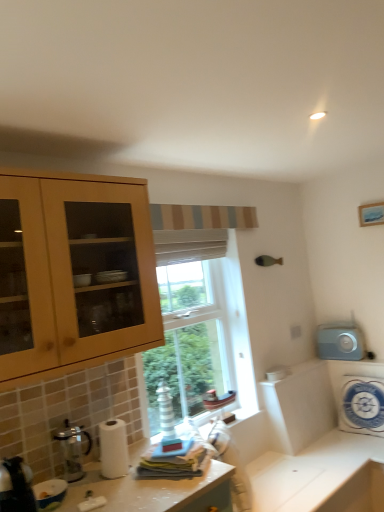
The width and height of the screenshot is (384, 512). What do you see at coordinates (50, 492) in the screenshot?
I see `white glossy bowl at lower left, which is counted as the third appliance, starting from the right` at bounding box center [50, 492].

What is the approximate height of white fabric cushion at right, acting as the fourth appliance starting from the left?

white fabric cushion at right, acting as the fourth appliance starting from the left, is 19.67 inches in height.

Where is `white fabric cushion at right, the 1th appliance viewed from the right`? This screenshot has height=512, width=384. white fabric cushion at right, the 1th appliance viewed from the right is located at coordinates (362, 405).

The image size is (384, 512). I want to click on metallic silver coffee maker at lower left, so click(72, 450).

Is white glossy countertop at lower center oriented towards gray matte clock at right, arranged as the third appliance when viewed from the left?

No, white glossy countertop at lower center is not aimed at gray matte clock at right, arranged as the third appliance when viewed from the left.

From a real-world perspective, is white glossy countertop at lower center under gray matte clock at right, arranged as the third appliance when viewed from the left?

Yes, from a real-world perspective, white glossy countertop at lower center is below gray matte clock at right, arranged as the third appliance when viewed from the left.

In the scene shown: From the image's perspective, between white glossy countertop at lower center and gray matte clock at right, which ranks as the 1th appliance in back-to-front order, who is located below?

From the image's view, white glossy countertop at lower center is below.

Looking at this image, is the depth of white glossy countertop at lower center greater than that of gray matte clock at right, arranged as the third appliance when viewed from the left?

No, white glossy countertop at lower center is in front of gray matte clock at right, arranged as the third appliance when viewed from the left.

Considering the positions of objects white glossy bowl at lower left, which is counted as the third appliance, starting from the right, and metallic silver coffee maker at lower left in the image provided, who is more to the right, white glossy bowl at lower left, which is counted as the third appliance, starting from the right, or metallic silver coffee maker at lower left?

metallic silver coffee maker at lower left.

The height and width of the screenshot is (512, 384). Find the location of `coffee machine on the right of white glossy bowl at lower left, which is counted as the third appliance, starting from the right`. coffee machine on the right of white glossy bowl at lower left, which is counted as the third appliance, starting from the right is located at coordinates click(x=72, y=450).

Is metallic silver coffee maker at lower left at the back of white glossy bowl at lower left, which is counted as the third appliance, starting from the right?

No, metallic silver coffee maker at lower left is not at the back of white glossy bowl at lower left, which is counted as the third appliance, starting from the right.

Based on the photo, from the image's perspective, is white glossy bowl at lower left, which is counted as the second appliance, starting from the front, on metallic silver coffee maker at lower left?

Incorrect, from the image's perspective, white glossy bowl at lower left, which is counted as the second appliance, starting from the front, is lower than metallic silver coffee maker at lower left.

Would you say gray matte clock at right, arranged as the 4th appliance when viewed from the front, contains white glossy countertop at lower center?

No, white glossy countertop at lower center is located outside of gray matte clock at right, arranged as the 4th appliance when viewed from the front.

The image size is (384, 512). Find the location of `the 3rd appliance behind when counting from the white glossy countertop at lower center`. the 3rd appliance behind when counting from the white glossy countertop at lower center is located at coordinates (340, 342).

In the scene shown: Considering the sizes of gray matte clock at right, which ranks as the 1th appliance in back-to-front order, and white glossy countertop at lower center in the image, is gray matte clock at right, which ranks as the 1th appliance in back-to-front order, wider or thinner than white glossy countertop at lower center?

Clearly, gray matte clock at right, which ranks as the 1th appliance in back-to-front order, has less width compared to white glossy countertop at lower center.

From a real-world perspective, is white textured curtain at window physically located above or below gray matte clock at right, arranged as the third appliance when viewed from the left?

From a real-world perspective, white textured curtain at window is physically above gray matte clock at right, arranged as the third appliance when viewed from the left.

Can you confirm if white textured curtain at window is wider than gray matte clock at right, arranged as the 2th appliance when viewed from the right?

Yes.

Considering the relative positions of white textured curtain at window and gray matte clock at right, which ranks as the 1th appliance in back-to-front order, in the image provided, is white textured curtain at window to the left or to the right of gray matte clock at right, which ranks as the 1th appliance in back-to-front order,?

white textured curtain at window is to the left of gray matte clock at right, which ranks as the 1th appliance in back-to-front order.

Are white textured curtain at window and gray matte clock at right, arranged as the third appliance when viewed from the left, making contact?

No.

The image size is (384, 512). Identify the location of countertop below the metallic silver kettle at lower left, which ranks as the 4th appliance in back-to-front order (from the image's perspective). (154, 492).

Considering the relative positions of metallic silver kettle at lower left, which is the 4th appliance from right to left, and white glossy countertop at lower center in the image provided, is metallic silver kettle at lower left, which is the 4th appliance from right to left, to the right of white glossy countertop at lower center from the viewer's perspective?

No.

Is point (18, 456) closer or farther from the camera than point (181, 484)?

Point (18, 456).

How much distance is there between metallic silver kettle at lower left, which is the 4th appliance from right to left, and white glossy countertop at lower center?

metallic silver kettle at lower left, which is the 4th appliance from right to left, and white glossy countertop at lower center are 17.27 inches apart from each other.

Which of these two, metallic silver kettle at lower left, which is the 4th appliance from right to left, or white textured curtain at window, is smaller?

metallic silver kettle at lower left, which is the 4th appliance from right to left, is smaller.

Is point (2, 467) positioned behind point (212, 234)?

No, (2, 467) is closer to viewer.

Where is `curtain behind the metallic silver kettle at lower left, which ranks as the 4th appliance in back-to-front order`? This screenshot has width=384, height=512. curtain behind the metallic silver kettle at lower left, which ranks as the 4th appliance in back-to-front order is located at coordinates (189, 245).

Between metallic silver kettle at lower left, which ranks as the 4th appliance in back-to-front order, and white fabric cushion at right, the second appliance when ordered from back to front, which one has less height?

Standing shorter between the two is metallic silver kettle at lower left, which ranks as the 4th appliance in back-to-front order.

Considering the relative sizes of metallic silver kettle at lower left, which is the 4th appliance from right to left, and white fabric cushion at right, the 1th appliance viewed from the right, in the image provided, is metallic silver kettle at lower left, which is the 4th appliance from right to left, wider than white fabric cushion at right, the 1th appliance viewed from the right,?

Yes.

Does point (28, 510) appear closer or farther from the camera than point (373, 411)?

Point (28, 510) appears to be closer to the viewer than point (373, 411).

Find the location of a particular element. countertop on the left of gray matte clock at right, arranged as the 2th appliance when viewed from the right is located at coordinates (154, 492).

This screenshot has height=512, width=384. There is a metallic silver coffee maker at lower left. Find the location of `the 1st appliance below it (from the image's perspective)`. the 1st appliance below it (from the image's perspective) is located at coordinates (50, 492).

Which object lies further to the anchor point white fabric cushion at right, the third appliance positioned from the front, white glossy countertop at lower center or white glossy countertop at lower center?

A: white glossy countertop at lower center is positioned further to the anchor white fabric cushion at right, the third appliance positioned from the front.

Estimate the real-world distances between objects in this image. Which object is closer to metallic silver kettle at lower left, which is the 4th appliance from right to left, metallic silver coffee maker at lower left or white glossy countertop at lower center?

The object closer to metallic silver kettle at lower left, which is the 4th appliance from right to left, is metallic silver coffee maker at lower left.

Looking at the image, which one is located further to white textured curtain at window, white fabric cushion at right, the 1th appliance viewed from the right, or white glossy bowl at lower left, which is counted as the third appliance, starting from the right?

white fabric cushion at right, the 1th appliance viewed from the right, is further to white textured curtain at window.

When comparing their distances from white glossy countertop at lower center, does white fabric cushion at right, the 1th appliance viewed from the right, or gray matte clock at right, arranged as the 2th appliance when viewed from the right, seem further?

Among the two, gray matte clock at right, arranged as the 2th appliance when viewed from the right, is located further to white glossy countertop at lower center.

From the image, which object appears to be nearer to white textured curtain at window, metallic silver kettle at lower left, which appears as the 1th appliance when viewed from the front, or gray matte clock at right, arranged as the third appliance when viewed from the left?

gray matte clock at right, arranged as the third appliance when viewed from the left, is closer to white textured curtain at window.

Based on their spatial positions, is white glossy countertop at lower center or gray matte clock at right, arranged as the 2th appliance when viewed from the right, closer to metallic silver kettle at lower left, placed as the 1th appliance when sorted from left to right?

white glossy countertop at lower center is closer to metallic silver kettle at lower left, placed as the 1th appliance when sorted from left to right.

Estimate the real-world distances between objects in this image. Which object is further from white textured curtain at window, metallic silver coffee maker at lower left or gray matte clock at right, which ranks as the 1th appliance in back-to-front order?

Based on the image, gray matte clock at right, which ranks as the 1th appliance in back-to-front order, appears to be further to white textured curtain at window.

When comparing their distances from white glossy countertop at lower center, does metallic silver kettle at lower left, placed as the 1th appliance when sorted from left to right, or white fabric cushion at right, the 1th appliance viewed from the right, seem closer?

metallic silver kettle at lower left, placed as the 1th appliance when sorted from left to right, is closer to white glossy countertop at lower center.

You are a GUI agent. You are given a task and a screenshot of the screen. Output one action in this format:
    pyautogui.click(x=<x>, y=<y>)
    Task: Click on the curtain between metallic silver coffee maker at lower left and white fabric cushion at right, the 1th appliance viewed from the right
    
    Given the screenshot: What is the action you would take?
    pyautogui.click(x=189, y=245)

Where is `appliance between metallic silver kettle at lower left, which is the 4th appliance from right to left, and metallic silver coffee maker at lower left from front to back`? The image size is (384, 512). appliance between metallic silver kettle at lower left, which is the 4th appliance from right to left, and metallic silver coffee maker at lower left from front to back is located at coordinates (50, 492).

At what (x,y) coordinates should I click in order to perform the action: click on coffee machine between white glossy bowl at lower left, which is counted as the third appliance, starting from the right, and gray matte clock at right, arranged as the 2th appliance when viewed from the right, in the horizontal direction. Please return your answer as a coordinate pair (x, y). The height and width of the screenshot is (512, 384). Looking at the image, I should click on (72, 450).

Where is `countertop between white glossy bowl at lower left, the 2th appliance from the left, and white glossy countertop at lower center from left to right`? countertop between white glossy bowl at lower left, the 2th appliance from the left, and white glossy countertop at lower center from left to right is located at coordinates (154, 492).